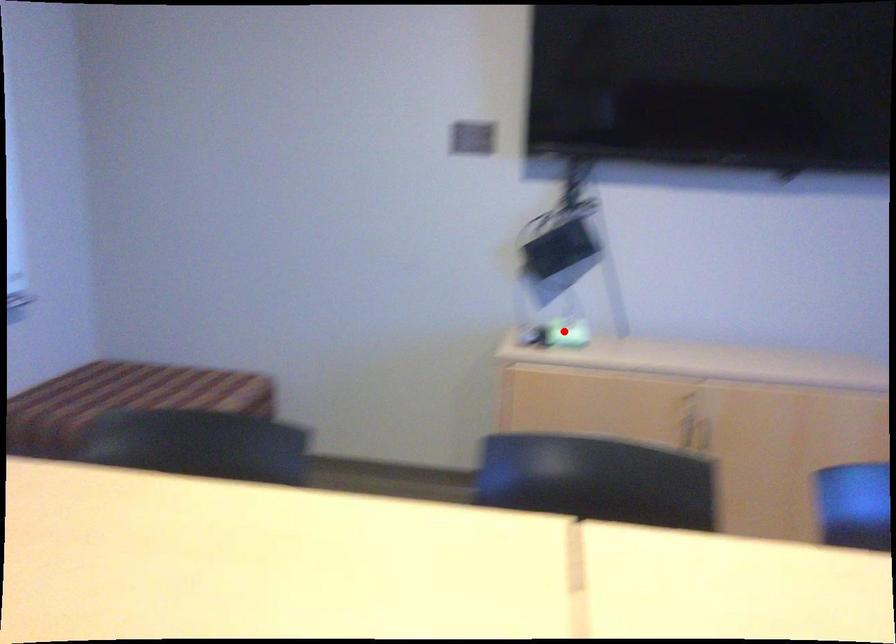
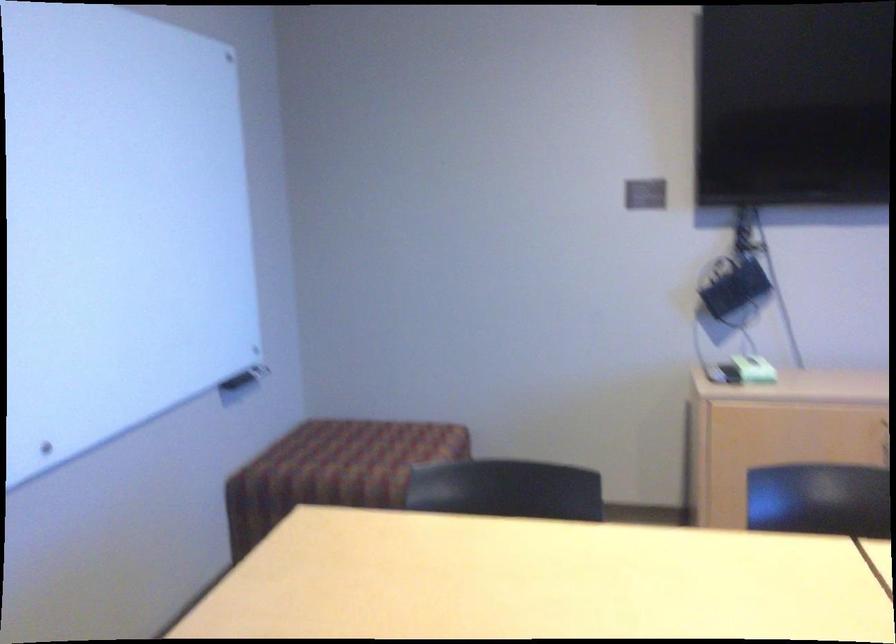
Locate, in the second image, the point that corresponds to the highlighted location in the first image.

(754, 368)